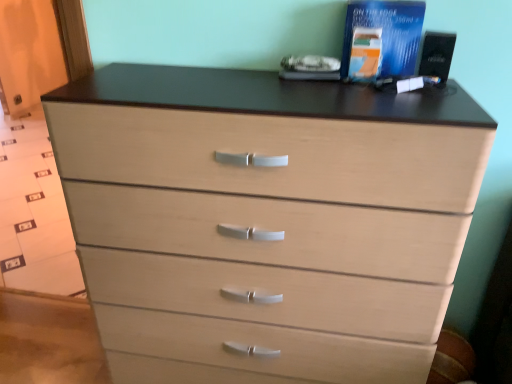
Locate an element on the screen. The height and width of the screenshot is (384, 512). unoccupied area in front of blue matte book at upper right, which is the 2th book from left to right is located at coordinates (364, 94).